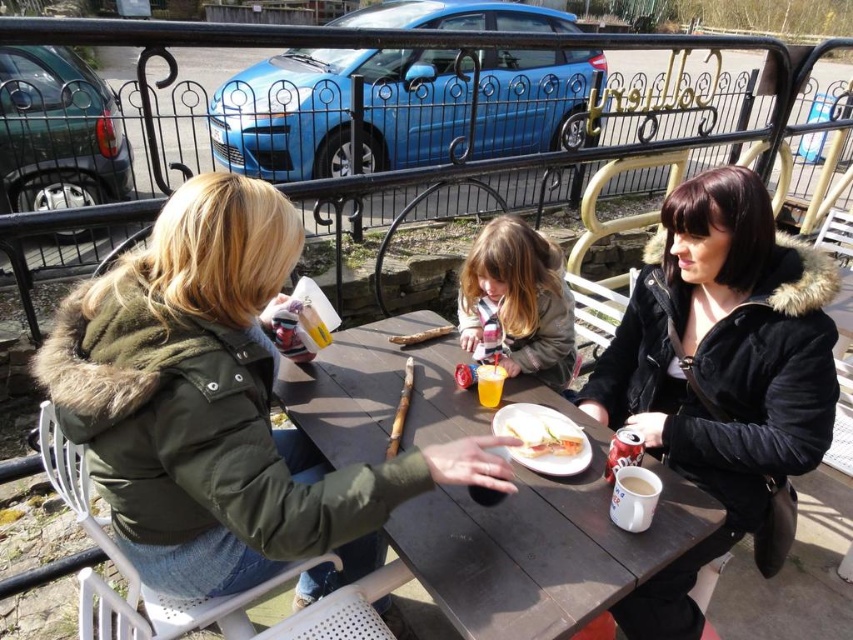
Between point (341, 435) and point (480, 241), which one is positioned in front?

Point (341, 435) is in front.

The image size is (853, 640). Find the location of `wooden table at center`. wooden table at center is located at coordinates (543, 541).

Which is more to the left, light brown hair at center or white bread at center?

Positioned to the left is light brown hair at center.

Is light brown hair at center thinner than white bread at center?

Incorrect, light brown hair at center's width is not less than white bread at center's.

Is point (498, 244) closer to camera compared to point (526, 452)?

No, (498, 244) is further to viewer.

Identify the location of light brown hair at center. This screenshot has width=853, height=640. (519, 300).

Can you confirm if green fuzzy jacket at center is positioned to the left of wooden table at center?

Yes, green fuzzy jacket at center is to the left of wooden table at center.

Who is lower down, green fuzzy jacket at center or wooden table at center?

green fuzzy jacket at center is below.

In order to click on green fuzzy jacket at center in this screenshot , I will do `click(219, 408)`.